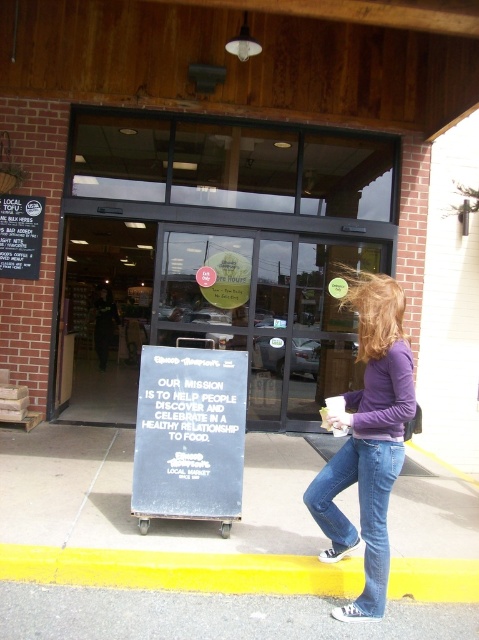
Question: Which object appears closest to the camera in this image?

Choices:
 (A) yellow asphalt at lower center
 (B) yellow rubber at lower left
 (C) blue denim jeans at lower center
 (D) purple cotton shirt at center

Answer: (A)

Question: Among these points, which one is farthest from the camera?

Choices:
 (A) (374, 541)
 (B) (468, 577)
 (C) (380, 598)

Answer: (B)

Question: Can you confirm if yellow asphalt at lower center is bigger than yellow rubber at lower left?

Choices:
 (A) yes
 (B) no

Answer: (A)

Question: Which point is farther to the camera?

Choices:
 (A) blue denim jeans at lower center
 (B) clear glass storefront at center
 (C) gray asphalt at lower center

Answer: (B)

Question: In this image, where is clear glass storefront at center located relative to yellow rubber at lower left?

Choices:
 (A) above
 (B) below

Answer: (A)

Question: Can you confirm if yellow asphalt at lower center is positioned to the right of gray asphalt at lower center?

Choices:
 (A) no
 (B) yes

Answer: (A)